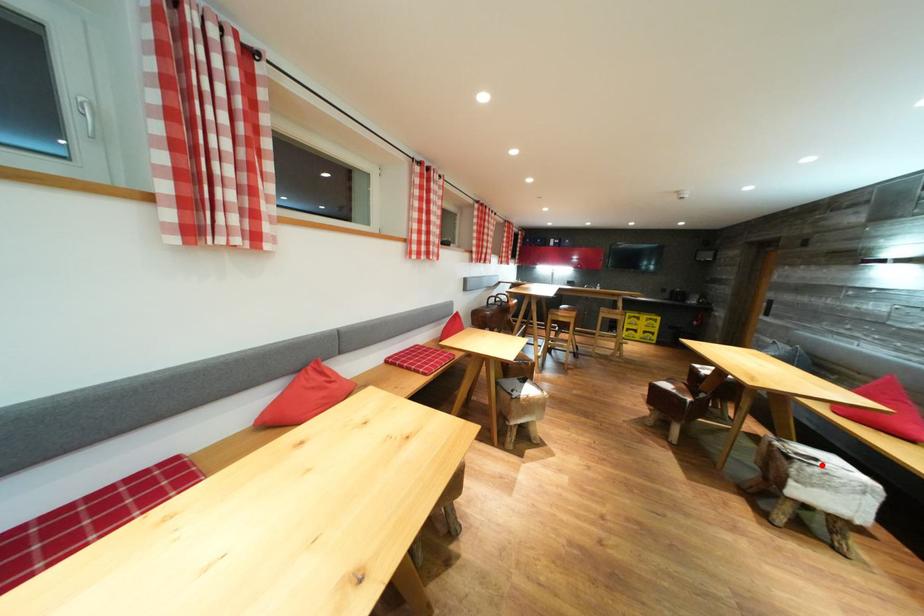
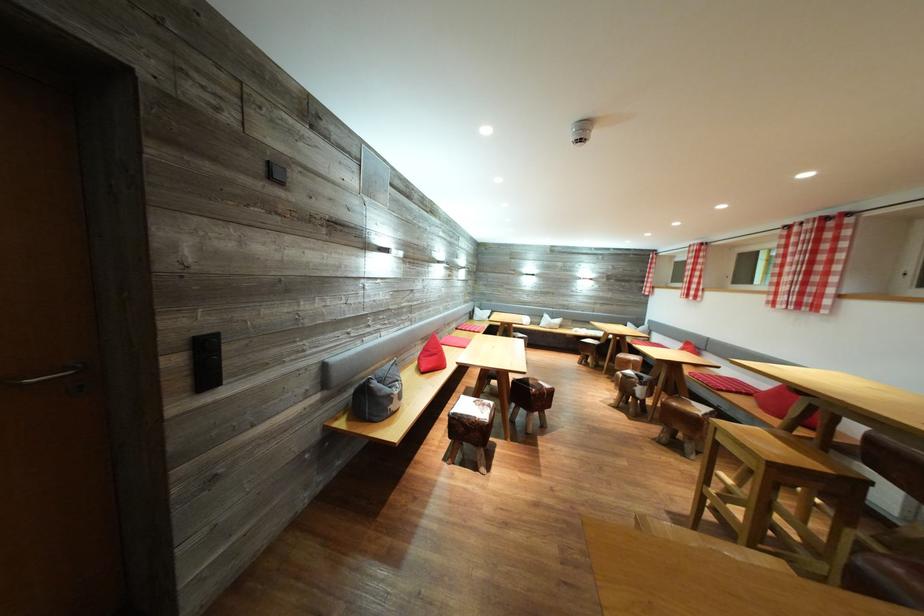
Question: I am providing you with two images of the same scene from different viewpoints. A red point is marked on the first image. At the location where the point appears in image 1, is it still visible in image 2?

Choices:
 (A) Yes
 (B) No

Answer: (B)